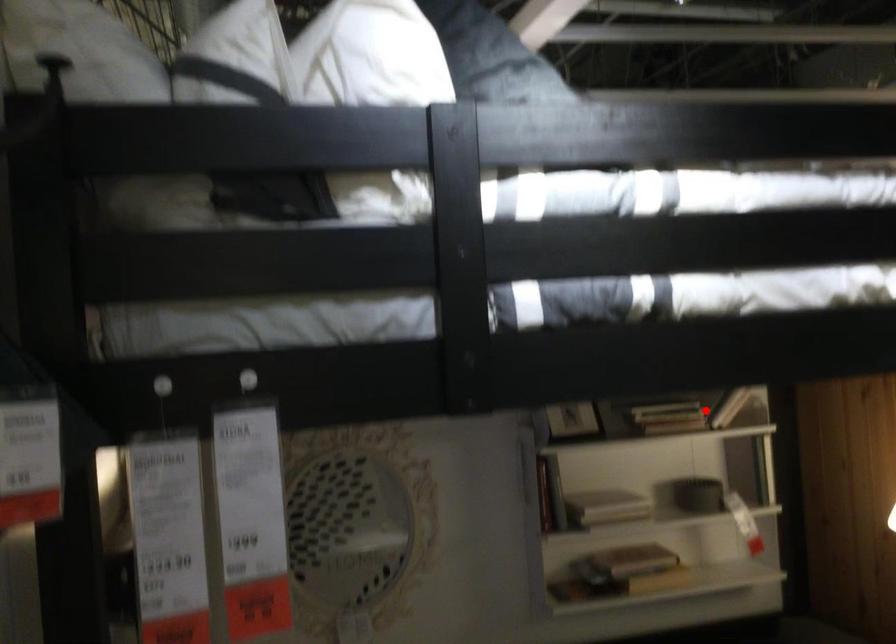
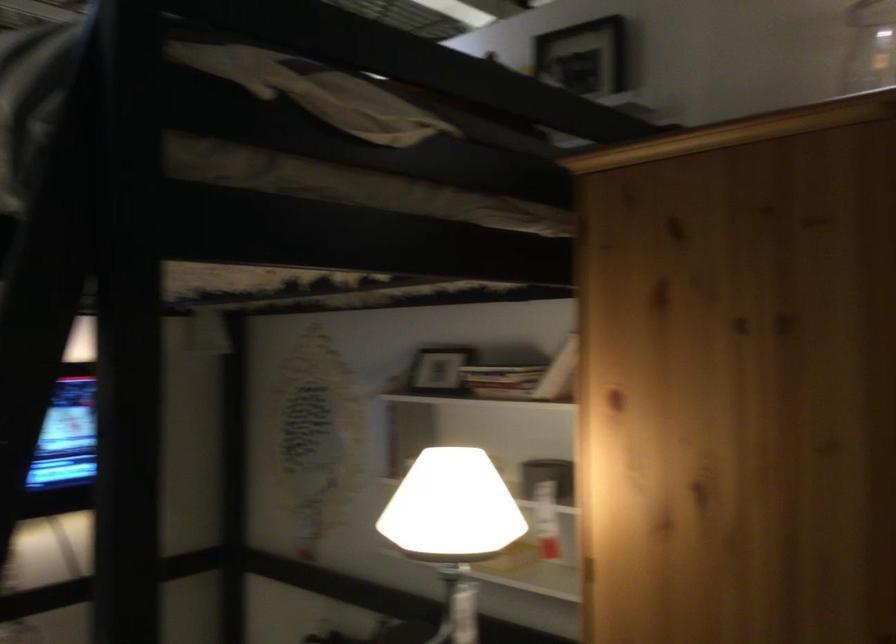
Question: I am providing you with two images of the same scene from different viewpoints. In image1, a red point is highlighted. Considering the same 3D point in image2, which of the following is correct?

Choices:
 (A) It is closer
 (B) It is farther

Answer: (A)